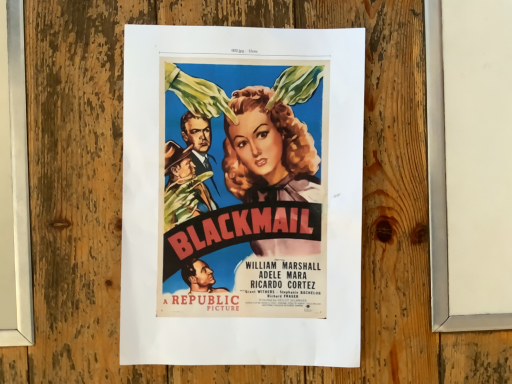
I want to click on free space above matte paper poster at center (from a real-world perspective), so click(243, 194).